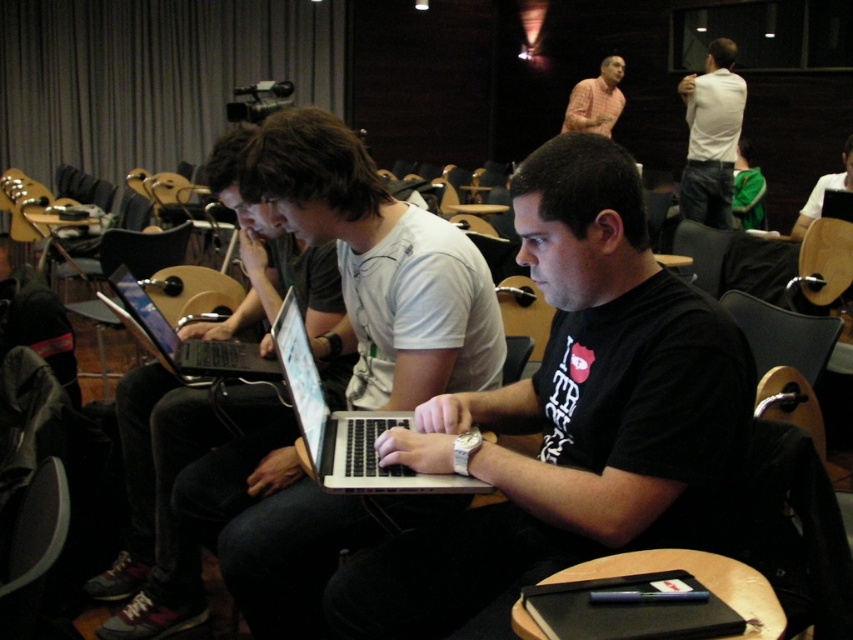
Question: Can you confirm if silver/black laptop at center is bigger than silver metallic laptop at center?

Choices:
 (A) yes
 (B) no

Answer: (B)

Question: Considering the real-world distances, which object is closest to the silver metallic laptop at center?

Choices:
 (A) white shirt at upper right
 (B) silver/black laptop at center
 (C) pink shirt at upper center
 (D) matte black laptop at center

Answer: (D)

Question: Where is matte black laptop at center located in relation to silver metallic laptop at center in the image?

Choices:
 (A) left
 (B) right

Answer: (A)

Question: Based on their relative distances, which object is nearer to the white shirt at upper right?

Choices:
 (A) silver metallic laptop at center
 (B) matte black laptop at center
 (C) silver/black laptop at center

Answer: (B)

Question: Which of the following is the farthest from the observer?

Choices:
 (A) silver/black laptop at center
 (B) matte black laptop at center
 (C) silver metallic laptop at center

Answer: (C)

Question: Is matte black laptop at center positioned at the back of pink shirt at upper center?

Choices:
 (A) yes
 (B) no

Answer: (B)